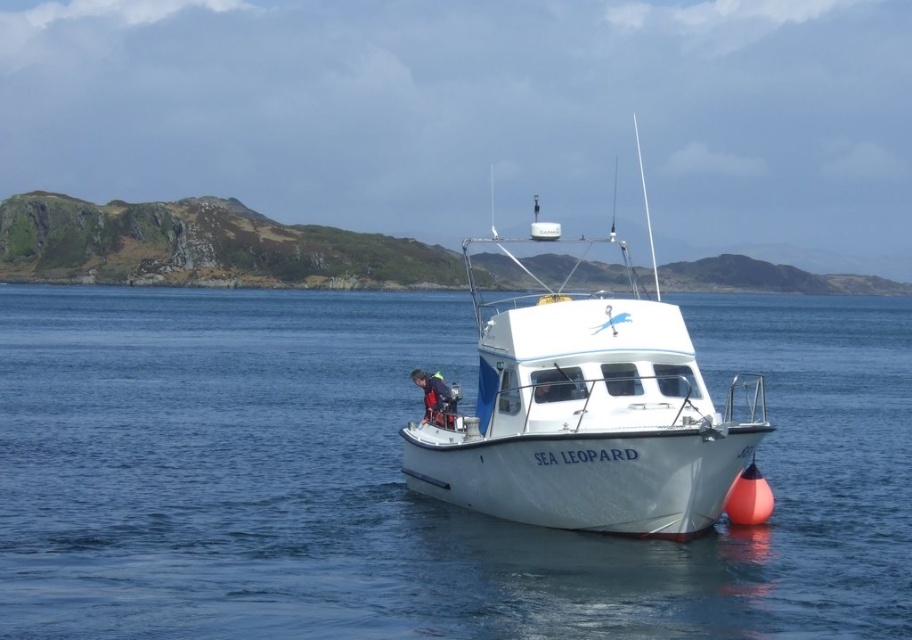
Question: Can you confirm if clear blue water at center is positioned above white glossy boat at center?

Choices:
 (A) yes
 (B) no

Answer: (B)

Question: In this image, where is clear blue water at center located relative to white glossy boat at center?

Choices:
 (A) right
 (B) left

Answer: (A)

Question: Among these objects, which one is farthest from the camera?

Choices:
 (A) blue fabric life jacket at center
 (B) white glossy boat at center
 (C) clear blue water at center

Answer: (A)

Question: Which of these objects is positioned closest to the white glossy boat at center?

Choices:
 (A) clear blue water at center
 (B) blue fabric life jacket at center

Answer: (A)

Question: Is clear blue water at center bigger than blue fabric life jacket at center?

Choices:
 (A) yes
 (B) no

Answer: (A)

Question: Which point appears closest to the camera in this image?

Choices:
 (A) (427, 376)
 (B) (693, 465)
 (C) (363, 538)

Answer: (B)